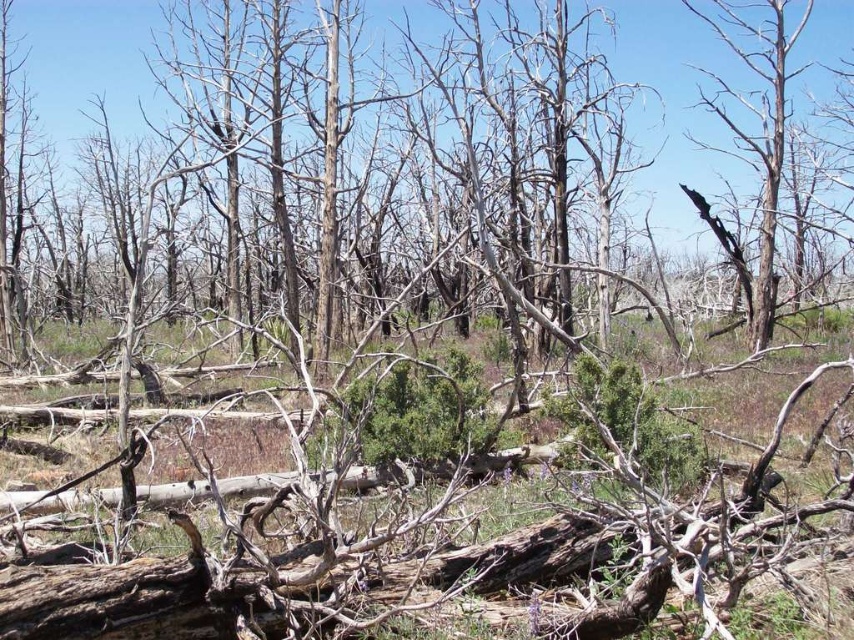
You are a hiker who has stumbled upon this desolate forest scene. You need to collect firewood for warmth. Which object should you choose between the dead wood at center and the charred wood tree at right, and why?

The dead wood at center is positioned on the left side of charred wood tree at right, so you should choose the dead wood at center because it is more accessible and closer to your current position compared to the charred wood tree at right.

You are a firefighter assessing the area after a wildfire. You notice the dead wood at center and the charred wood tree at right. Which object is closer to you as you stand in the scene?

The dead wood at center is closer to you because the charred wood tree at right is positioned behind it.